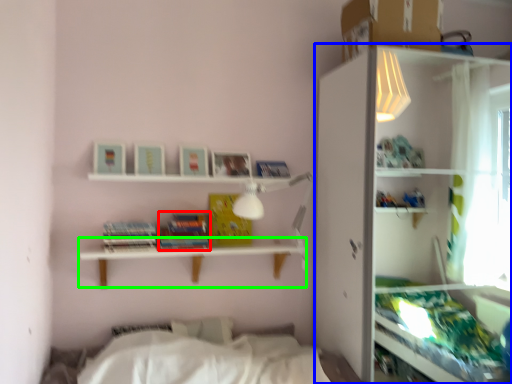
Question: Estimate the real-world distances between objects in this image. Which object is closer to paperback book (highlighted by a red box), shelf (highlighted by a blue box) or table (highlighted by a green box)?

Choices:
 (A) shelf
 (B) table

Answer: (B)